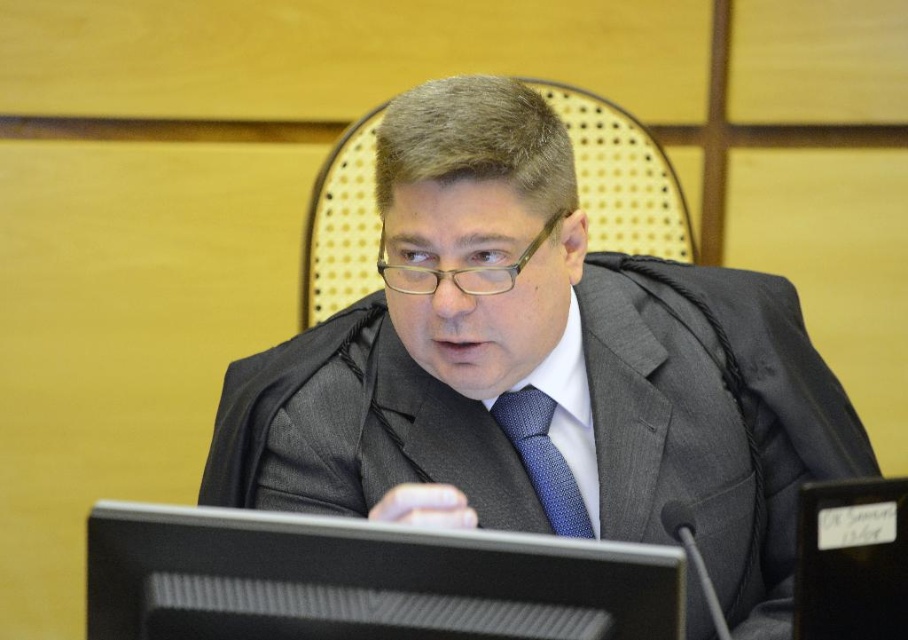
Can you confirm if gray suit at center is bigger than black matte computer screen at center?

Correct, gray suit at center is larger in size than black matte computer screen at center.

Looking at this image, is gray suit at center wider than black matte computer screen at center?

Yes, gray suit at center is wider than black matte computer screen at center.

Is point (638, 394) positioned after point (400, 624)?

Yes, it is behind point (400, 624).

Locate an element on the screen. The width and height of the screenshot is (908, 640). gray suit at center is located at coordinates (540, 368).

Does gray suit at center appear under blue dotted fabric tie at center?

Incorrect, gray suit at center is not positioned below blue dotted fabric tie at center.

Is gray suit at center thinner than blue dotted fabric tie at center?

Incorrect, gray suit at center's width is not less than blue dotted fabric tie at center's.

Between point (429, 493) and point (541, 476), which one is positioned behind?

The point (541, 476) is behind.

The height and width of the screenshot is (640, 908). Find the location of `gray suit at center`. gray suit at center is located at coordinates (540, 368).

Is black matte computer screen at center shorter than blue dotted fabric tie at center?

Yes.

From the picture: Between black matte computer screen at center and blue dotted fabric tie at center, which one has more height?

Standing taller between the two is blue dotted fabric tie at center.

Does point (245, 536) come in front of point (535, 456)?

Yes, it is.

Identify the location of black matte computer screen at center. (363, 580).